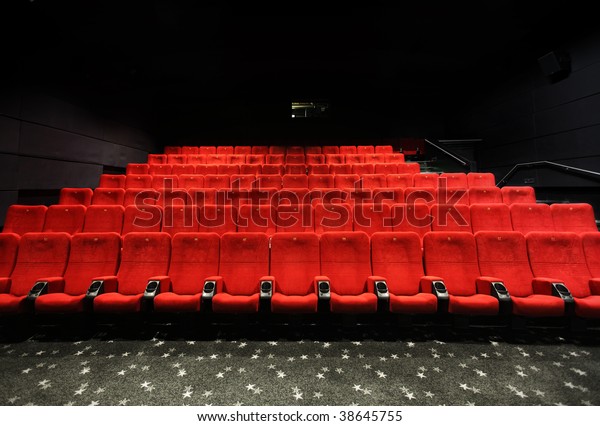
You are a GUI agent. You are given a task and a screenshot of the screen. Output one action in this format:
    pyautogui.click(x=<x>, y=<y>)
    Task: Click on the cup holders
    Image resolution: width=600 pixels, height=426 pixels.
    Given the screenshot: What is the action you would take?
    pyautogui.click(x=26, y=302), pyautogui.click(x=89, y=286), pyautogui.click(x=149, y=297), pyautogui.click(x=203, y=293), pyautogui.click(x=264, y=293), pyautogui.click(x=326, y=297), pyautogui.click(x=380, y=296), pyautogui.click(x=443, y=297), pyautogui.click(x=504, y=295), pyautogui.click(x=562, y=297)